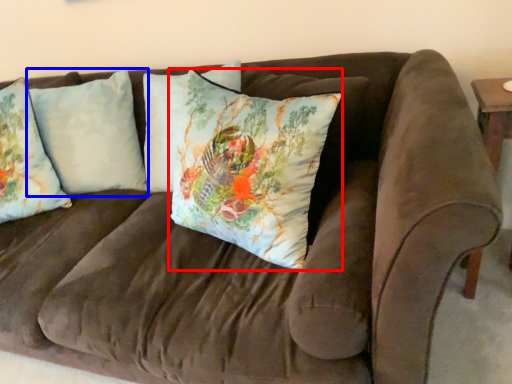
Question: Among these objects, which one is farthest to the camera, pillow (highlighted by a red box) or pillow (highlighted by a blue box)?

Choices:
 (A) pillow
 (B) pillow

Answer: (B)